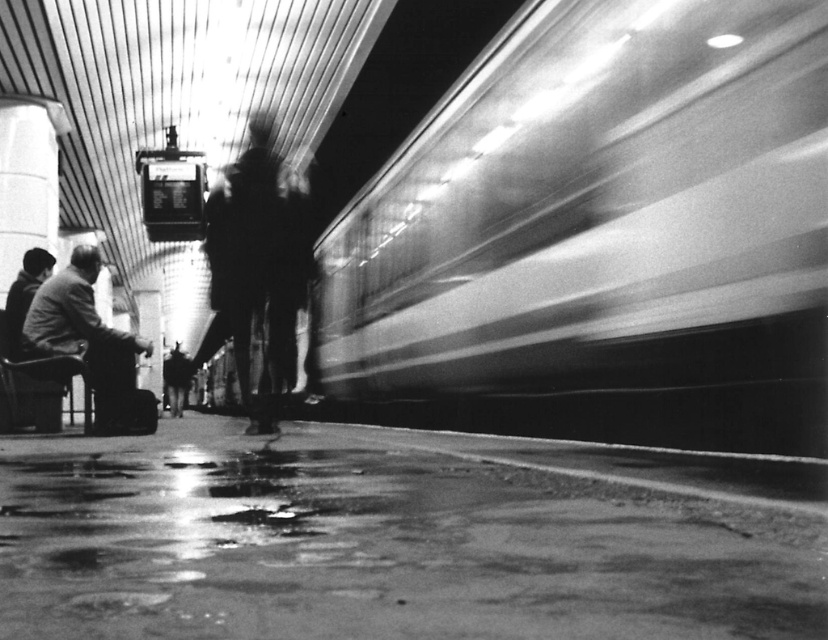
Is point (682, 241) farther from viewer compared to point (94, 337)?

No, it is not.

Is smooth metallic train at right wider than dark gray wool coat at lower left?

No, smooth metallic train at right is not wider than dark gray wool coat at lower left.

Is point (441, 307) positioned after point (85, 296)?

Yes, it is behind point (85, 296).

Where is `smooth metallic train at right`? smooth metallic train at right is located at coordinates (599, 234).